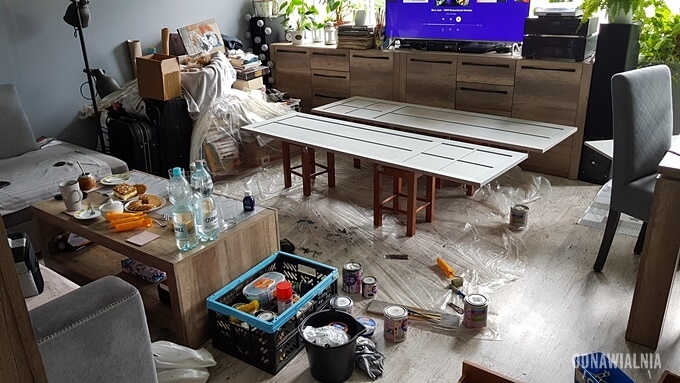
Find the location of `diy white painted doors`. diy white painted doors is located at coordinates (345, 133), (417, 114).